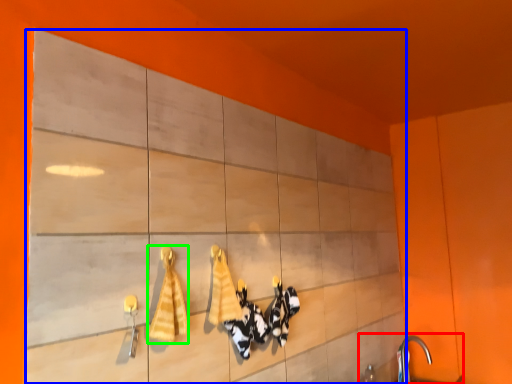
Question: Which is farther away from sink (highlighted by a red box)? cabinetry (highlighted by a blue box) or bath towel (highlighted by a green box)?

Choices:
 (A) cabinetry
 (B) bath towel

Answer: (B)